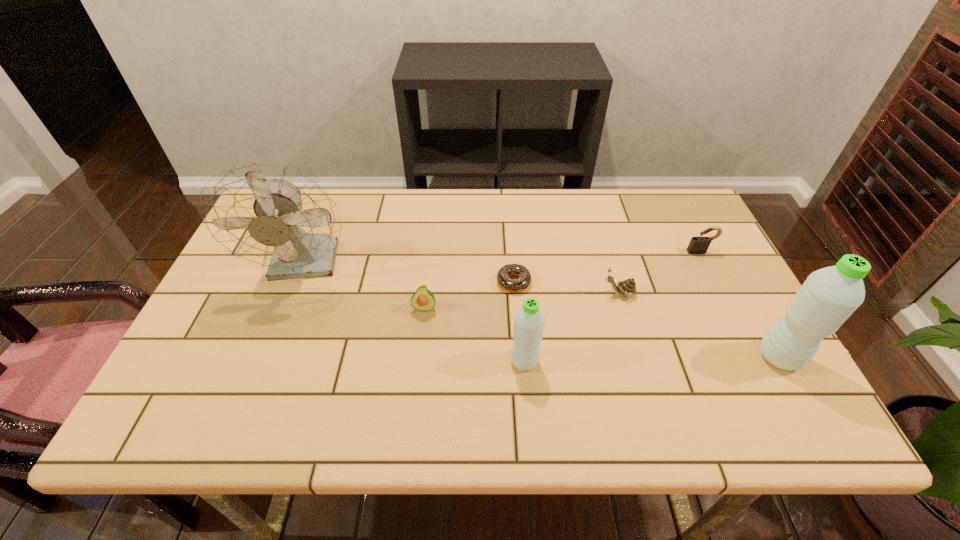
At what (x,y) coordinates should I click in order to perform the action: click on object that is positioned at the left edge. Please return your answer as a coordinate pair (x, y). This screenshot has width=960, height=540. Looking at the image, I should click on (270, 216).

Locate an element on the screen. This screenshot has width=960, height=540. water bottle at the right edge is located at coordinates (828, 297).

The image size is (960, 540). In order to click on padlock present at the right edge in this screenshot , I will do `click(698, 245)`.

Locate an element on the screen. object that is positioned at the near right corner is located at coordinates (828, 297).

Image resolution: width=960 pixels, height=540 pixels. In the image, there is a desktop. What are the coordinates of `free space at the far edge` in the screenshot? It's located at (622, 202).

You are a GUI agent. You are given a task and a screenshot of the screen. Output one action in this format:
    pyautogui.click(x=<x>, y=<y>)
    Task: Click on the free space at the near edge
    Image resolution: width=960 pixels, height=540 pixels.
    Given the screenshot: What is the action you would take?
    pyautogui.click(x=266, y=393)

This screenshot has height=540, width=960. I want to click on vacant space at the right edge of the desktop, so click(x=721, y=329).

Image resolution: width=960 pixels, height=540 pixels. In the image, there is a desktop. What are the coordinates of `vacant space at the near left corner` in the screenshot? It's located at (199, 367).

This screenshot has height=540, width=960. In the image, there is a desktop. In order to click on vacant space at the far right corner in this screenshot , I will do `click(660, 189)`.

The image size is (960, 540). Identify the location of blank region between the doughnut and the fifth object from left to right. (566, 288).